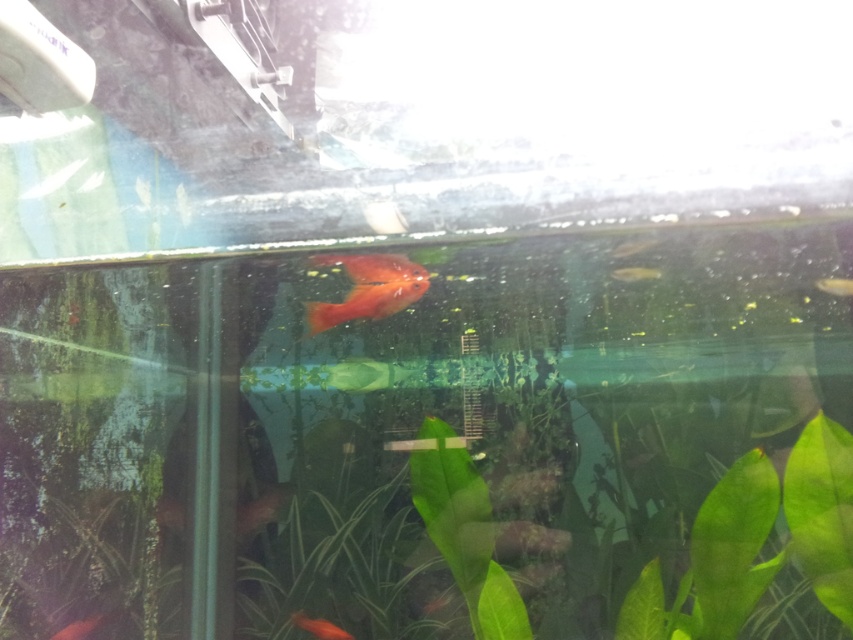
Looking at this image, can you confirm if translucent yellowish fish at upper right is shorter than shiny orange fish at center?

Yes, translucent yellowish fish at upper right is shorter than shiny orange fish at center.

Can you confirm if translucent yellowish fish at upper right is positioned below shiny orange fish at center?

Yes, translucent yellowish fish at upper right is below shiny orange fish at center.

Is point (824, 282) less distant than point (181, 192)?

No, it is behind (181, 192).

I want to click on translucent yellowish fish at upper right, so click(x=834, y=285).

Is the position of glossy orange goldfish at center more distant than that of shiny orange fish at center?

No.

Who is more forward, (415, 298) or (183, 186)?

Point (183, 186) is more forward.

Which is behind, point (340, 321) or point (178, 189)?

The point (340, 321) is more distant.

Where is `glossy orange goldfish at center`? Image resolution: width=853 pixels, height=640 pixels. glossy orange goldfish at center is located at coordinates click(x=368, y=289).

Is shiny orange fish at lower left above shiny orange fish at upper center?

Actually, shiny orange fish at lower left is below shiny orange fish at upper center.

Is shiny orange fish at lower left thinner than shiny orange fish at upper center?

No.

Where is `shiny orange fish at lower left`? shiny orange fish at lower left is located at coordinates (79, 627).

Find the location of a particular element. shiny orange fish at lower left is located at coordinates (79, 627).